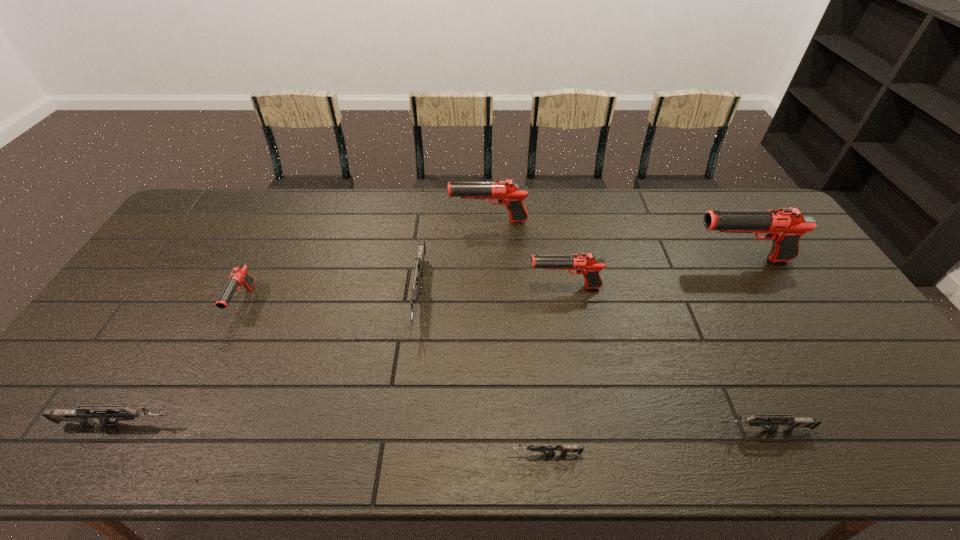
Where is `vacant space situated 0.080m aimed along the barrel of the nearest object`? The width and height of the screenshot is (960, 540). vacant space situated 0.080m aimed along the barrel of the nearest object is located at coordinates (471, 454).

Where is `vacant area situated aimed along the barrel of the nearest object`? Image resolution: width=960 pixels, height=540 pixels. vacant area situated aimed along the barrel of the nearest object is located at coordinates (326, 454).

Where is `vacant area situated 0.270m aimed along the barrel of the nearest object`? The height and width of the screenshot is (540, 960). vacant area situated 0.270m aimed along the barrel of the nearest object is located at coordinates (386, 454).

Image resolution: width=960 pixels, height=540 pixels. Find the location of `object at the far edge`. object at the far edge is located at coordinates (508, 193).

Find the location of `object that is at the left edge`. object that is at the left edge is located at coordinates (82, 414).

Where is `object that is at the right edge`? The width and height of the screenshot is (960, 540). object that is at the right edge is located at coordinates (785, 226).

Find the location of `object that is at the near left corner`. object that is at the near left corner is located at coordinates (82, 414).

In the image, there is a desktop. Identify the location of vacant space at the far edge. The width and height of the screenshot is (960, 540). (708, 192).

At what (x,y) coordinates should I click in order to perform the action: click on vacant area at the near edge. Please return your answer as a coordinate pair (x, y). Looking at the image, I should click on (458, 438).

At what (x,y) coordinates should I click in order to perform the action: click on vacant point at the left edge. Please return your answer as a coordinate pair (x, y). This screenshot has height=540, width=960. Looking at the image, I should click on (149, 331).